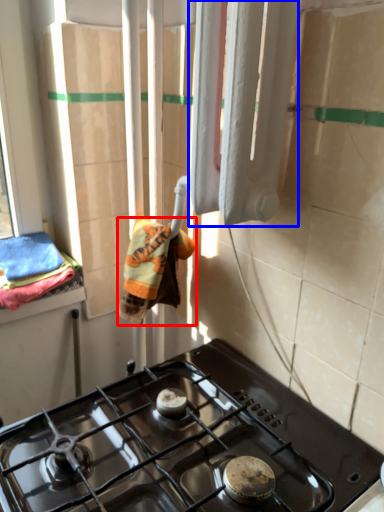
Question: Among these objects, which one is nearest to the camera, bath towel (highlighted by a red box) or curtain (highlighted by a blue box)?

Choices:
 (A) bath towel
 (B) curtain

Answer: (B)